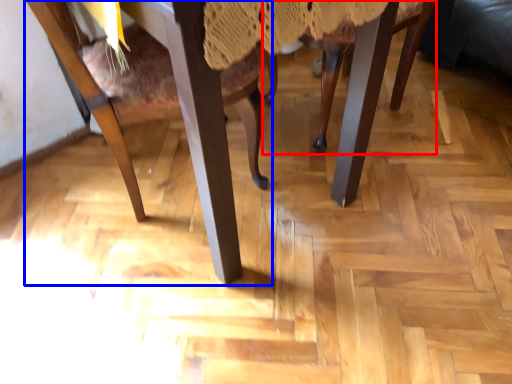
Question: Which point is further to the camera, chair (highlighted by a red box) or chair (highlighted by a blue box)?

Choices:
 (A) chair
 (B) chair

Answer: (A)